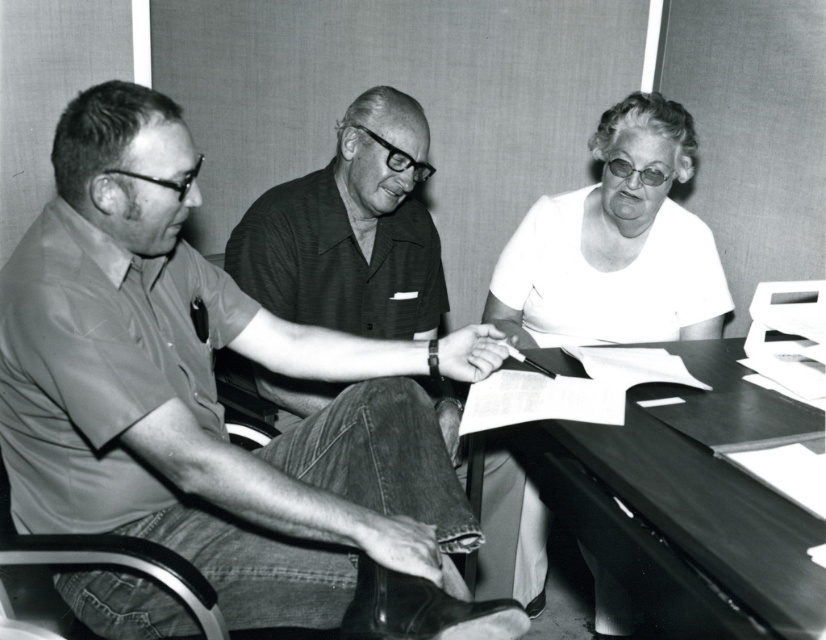
Question: Is matte gray shirt at center positioned before white matte shirt at center?

Choices:
 (A) no
 (B) yes

Answer: (B)

Question: Estimate the real-world distances between objects in this image. Which object is farther from the white matte shirt at center?

Choices:
 (A) matte gray shirt at center
 (B) smooth dark wood table at center

Answer: (A)

Question: Can you confirm if matte gray shirt at center is positioned above smooth dark wood table at center?

Choices:
 (A) yes
 (B) no

Answer: (A)

Question: Which of the following is the closest to the observer?

Choices:
 (A) matte gray shirt at center
 (B) white matte shirt at center

Answer: (A)

Question: Estimate the real-world distances between objects in this image. Which object is closer to the white matte shirt at center?

Choices:
 (A) matte gray shirt at center
 (B) smooth dark wood table at center

Answer: (B)

Question: Can you confirm if matte gray shirt at center is smaller than white matte shirt at center?

Choices:
 (A) yes
 (B) no

Answer: (B)